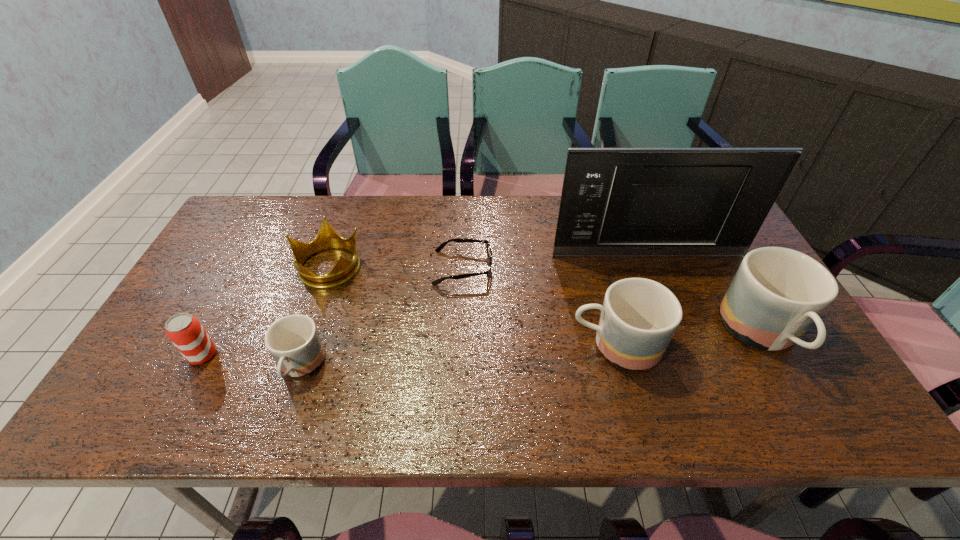
This screenshot has width=960, height=540. In order to click on vacant space that satisfies the following two spatial constraints: 1. on the front panel of the microwave oven; 2. on the front-facing side of the shortest object in this screenshot , I will do `click(652, 268)`.

Find the location of a particular element. vacant point that satisfies the following two spatial constraints: 1. on the front panel of the microwave oven; 2. on the front-facing side of the shortest object is located at coordinates (652, 268).

You are a GUI agent. You are given a task and a screenshot of the screen. Output one action in this format:
    pyautogui.click(x=<x>, y=<y>)
    Task: Click on the vacant region that satisfies the following two spatial constraints: 1. on the front-facing side of the spectacles; 2. on the side with the handle of the shortest mug
    The width and height of the screenshot is (960, 540).
    Given the screenshot: What is the action you would take?
    459,367

You are a GUI agent. You are given a task and a screenshot of the screen. Output one action in this format:
    pyautogui.click(x=<x>, y=<y>)
    Task: Click on the free space that satisfies the following two spatial constraints: 1. on the front panel of the tallest object; 2. on the side with the handle of the second tallest mug
    
    Given the screenshot: What is the action you would take?
    pyautogui.click(x=683, y=346)

The image size is (960, 540). Identify the location of free space that satisfies the following two spatial constraints: 1. on the back side of the crown; 2. on the right side of the leftmost object. (251, 266).